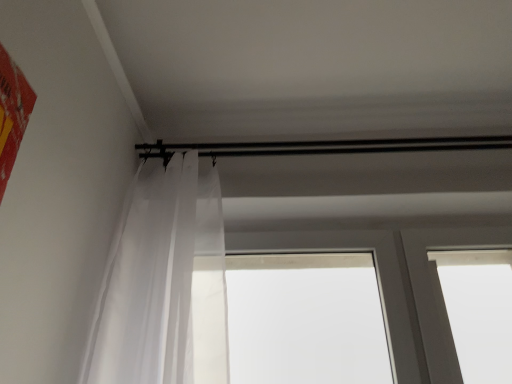
Measure the distance between translucent fabric curtain at left and camera.

97.30 centimeters.

Find the location of a particular element. translucent fabric curtain at left is located at coordinates (164, 285).

The height and width of the screenshot is (384, 512). Describe the element at coordinates (164, 285) in the screenshot. I see `translucent fabric curtain at left` at that location.

Describe the element at coordinates (379, 279) in the screenshot. This screenshot has height=384, width=512. I see `transparent plastic window at center` at that location.

What is the approximate width of transparent plastic window at center?

The width of transparent plastic window at center is 4.13 inches.

Locate an element on the screen. This screenshot has width=512, height=384. transparent plastic window at center is located at coordinates (379, 279).

Looking at this image, measure the distance between transparent plastic window at center and camera.

A distance of 1.25 meters exists between transparent plastic window at center and camera.

The height and width of the screenshot is (384, 512). I want to click on translucent fabric curtain at left, so click(164, 285).

Considering the relative positions of translucent fabric curtain at left and transparent plastic window at center in the image provided, is translucent fabric curtain at left to the right of transparent plastic window at center from the viewer's perspective?

Incorrect, translucent fabric curtain at left is not on the right side of transparent plastic window at center.

Considering their positions, is translucent fabric curtain at left located in front of or behind transparent plastic window at center?

Visually, translucent fabric curtain at left is located in front of transparent plastic window at center.

Which point is more distant from viewer, (x=169, y=363) or (x=336, y=249)?

The point (x=336, y=249) is farther.

From the image's perspective, is translucent fabric curtain at left below transparent plastic window at center?

No.

From a real-world perspective, which is physically below, translucent fabric curtain at left or transparent plastic window at center?

transparent plastic window at center, from a real-world perspective.

Considering the sizes of objects translucent fabric curtain at left and transparent plastic window at center in the image provided, who is wider, translucent fabric curtain at left or transparent plastic window at center?

With larger width is translucent fabric curtain at left.

Which of these two, translucent fabric curtain at left or transparent plastic window at center, stands taller?

translucent fabric curtain at left is taller.

Can you confirm if translucent fabric curtain at left is smaller than transparent plastic window at center?

No, translucent fabric curtain at left is not smaller than transparent plastic window at center.

Is transparent plastic window at center completely or partially inside translucent fabric curtain at left?

No, transparent plastic window at center is not surrounded by translucent fabric curtain at left.

Are translucent fabric curtain at left and transparent plastic window at center making contact?

There is a gap between translucent fabric curtain at left and transparent plastic window at center.

Does translucent fabric curtain at left turn towards transparent plastic window at center?

No, translucent fabric curtain at left is not oriented towards transparent plastic window at center.

Can you tell me how much translucent fabric curtain at left and transparent plastic window at center differ in facing direction?

They differ by 0.0173 degrees in their facing directions.

The image size is (512, 384). I want to click on curtain on the left side of transparent plastic window at center, so click(164, 285).

Considering the relative positions of transparent plastic window at center and translucent fabric curtain at left in the image provided, is transparent plastic window at center to the right of translucent fabric curtain at left from the viewer's perspective?

Indeed, transparent plastic window at center is positioned on the right side of translucent fabric curtain at left.

Between transparent plastic window at center and translucent fabric curtain at left, which one is positioned behind?

transparent plastic window at center.

Considering the positions of point (298, 244) and point (181, 295), is point (298, 244) closer or farther from the camera than point (181, 295)?

Point (298, 244) is farther from the camera than point (181, 295).

From the image's perspective, which is below, transparent plastic window at center or translucent fabric curtain at left?

From the image's view, transparent plastic window at center is below.

From a real-world perspective, is transparent plastic window at center physically above translucent fabric curtain at left?

Actually, transparent plastic window at center is physically below translucent fabric curtain at left in the real world.

Based on the photo, which of these two, transparent plastic window at center or translucent fabric curtain at left, is thinner?

transparent plastic window at center.

Consider the image. Does transparent plastic window at center have a lesser height compared to translucent fabric curtain at left?

Yes, transparent plastic window at center is shorter than translucent fabric curtain at left.

Consider the image. Who is smaller, transparent plastic window at center or translucent fabric curtain at left?

Smaller between the two is transparent plastic window at center.

Is transparent plastic window at center outside of translucent fabric curtain at left?

transparent plastic window at center is positioned outside translucent fabric curtain at left.

Consider the image. Can you see transparent plastic window at center touching translucent fabric curtain at left?

No, transparent plastic window at center is not in contact with translucent fabric curtain at left.

Is transparent plastic window at center facing towards translucent fabric curtain at left?

Yes, transparent plastic window at center is aimed at translucent fabric curtain at left.

What's the angular difference between transparent plastic window at center and translucent fabric curtain at left's facing directions?

There is a 0.0173-degree angle between the facing directions of transparent plastic window at center and translucent fabric curtain at left.

Find the location of `window behind the translucent fabric curtain at left`. window behind the translucent fabric curtain at left is located at coordinates (379, 279).

This screenshot has height=384, width=512. Identify the location of curtain located above the transparent plastic window at center (from a real-world perspective). (164, 285).

Identify the location of curtain on the left of transparent plastic window at center. This screenshot has height=384, width=512. (164, 285).